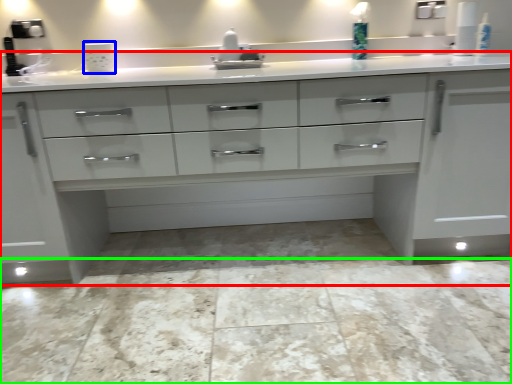
Question: Considering the real-world distances, which object is farthest from chest of drawers (highlighted by a red box)? appliance (highlighted by a blue box) or granite (highlighted by a green box)?

Choices:
 (A) appliance
 (B) granite

Answer: (A)